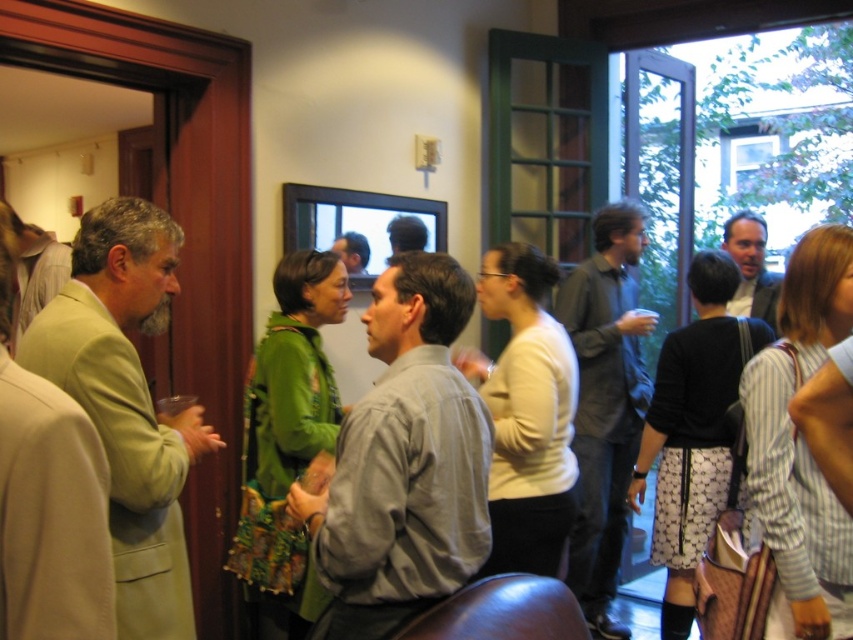
What are the coordinates of `gray cotton shirt at center` in the screenshot? It's located at (404, 461).

Does gray cotton shirt at center appear over light green wool coat at left?

Actually, gray cotton shirt at center is below light green wool coat at left.

Locate an element on the screen. gray cotton shirt at center is located at coordinates [x=404, y=461].

At what (x,y) coordinates should I click in order to perform the action: click on gray cotton shirt at center. Please return your answer as a coordinate pair (x, y). Looking at the image, I should click on (404, 461).

Does light green wool coat at left appear on the right side of smooth gray suit at center?

In fact, light green wool coat at left is to the left of smooth gray suit at center.

Who is taller, light green wool coat at left or smooth gray suit at center?

light green wool coat at left

Is point (90, 225) in front of point (747, 236)?

Yes, point (90, 225) is closer to viewer.

The image size is (853, 640). Identify the location of light green wool coat at left. (126, 403).

Is point (427, 570) closer to camera compared to point (741, 282)?

Yes, point (427, 570) is in front of point (741, 282).

Is gray cotton shirt at center to the left of smooth gray suit at center from the viewer's perspective?

Indeed, gray cotton shirt at center is positioned on the left side of smooth gray suit at center.

This screenshot has height=640, width=853. What do you see at coordinates (404, 461) in the screenshot?
I see `gray cotton shirt at center` at bounding box center [404, 461].

At what (x,y) coordinates should I click in order to perform the action: click on gray cotton shirt at center. Please return your answer as a coordinate pair (x, y). Image resolution: width=853 pixels, height=640 pixels. Looking at the image, I should click on (404, 461).